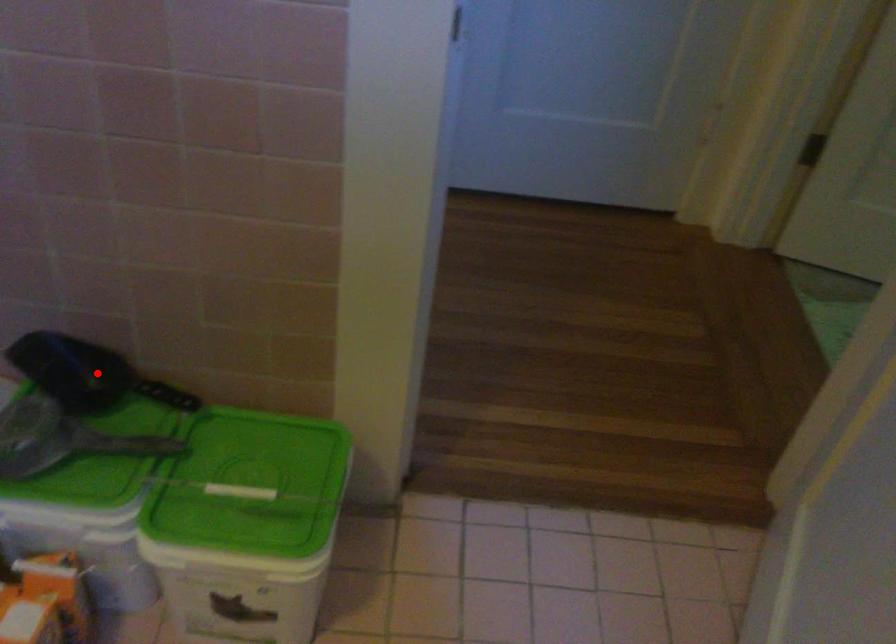
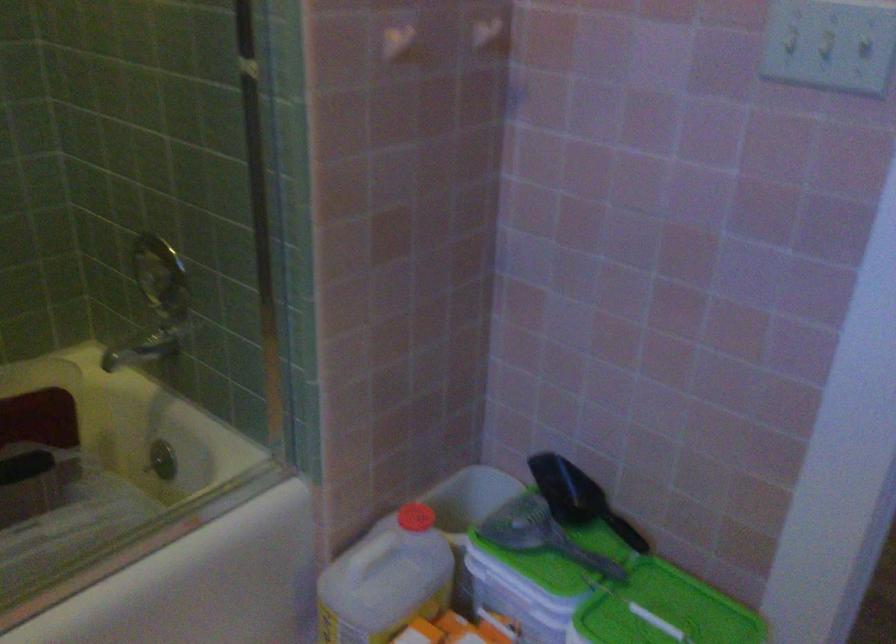
Question: I am providing you with two images of the same scene from different viewpoints. A red point is shown in image1. For the corresponding object point in image2, is it positioned nearer or farther from the camera?

Choices:
 (A) Nearer
 (B) Farther

Answer: (B)